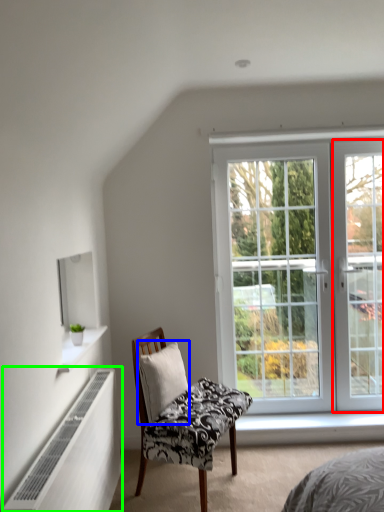
Question: Based on their relative distances, which object is farther from screen door (highlighted by a red box)? Choose from pillow (highlighted by a blue box) and radiator (highlighted by a green box).

Choices:
 (A) pillow
 (B) radiator

Answer: (B)